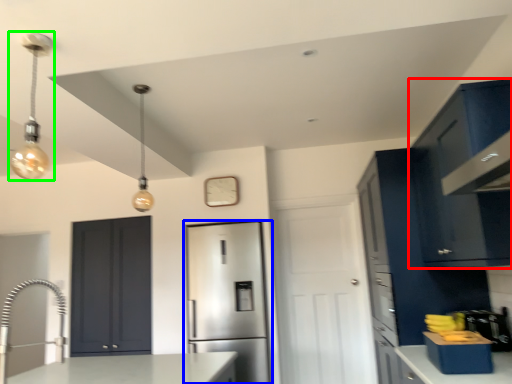
Question: Considering the real-world distances, which object is closest to cabinetry (highlighted by a red box)? refrigerator (highlighted by a blue box) or light fixture (highlighted by a green box).

Choices:
 (A) refrigerator
 (B) light fixture

Answer: (B)